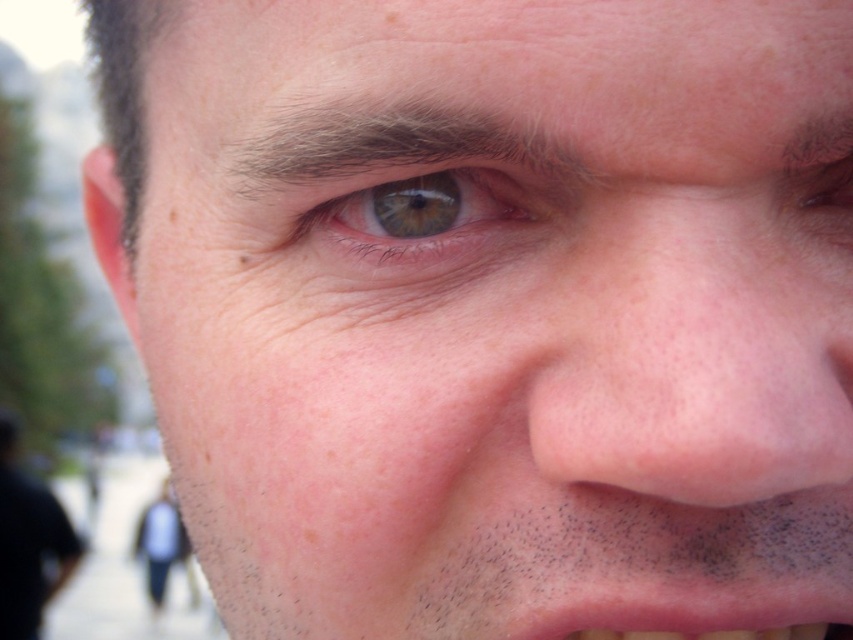
You are a dermatologist analyzing a patient photo. The image shows a close up of a face with a point marked at coordinates (698, 342). Based on the scene description, what body part is this point likely indicating?

The point at (698, 342) corresponds to the dry skin nose at center, as described in the objects description.